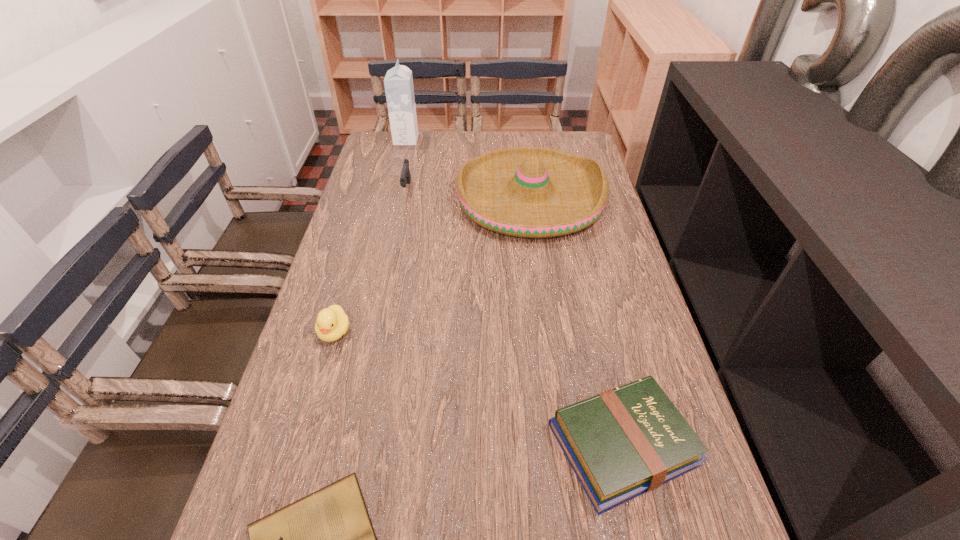
The image size is (960, 540). Identify the location of the tallest object. (398, 82).

The width and height of the screenshot is (960, 540). Identify the location of the farthest object. (398, 82).

I want to click on the fifth shortest object, so tap(531, 192).

Identify the location of pistol. The width and height of the screenshot is (960, 540). (405, 178).

The height and width of the screenshot is (540, 960). I want to click on duckling, so click(x=332, y=323).

Where is `the right book`? the right book is located at coordinates (621, 443).

Where is `the second shortest object`? The width and height of the screenshot is (960, 540). the second shortest object is located at coordinates (621, 443).

Where is `vacant space situated on the front label of the carton`? vacant space situated on the front label of the carton is located at coordinates (498, 140).

Locate an element on the screen. blank space located 0.240m on the left of the fifth shortest object is located at coordinates (381, 198).

Where is `vacant position located at the barrel of the pistol`? vacant position located at the barrel of the pistol is located at coordinates (386, 291).